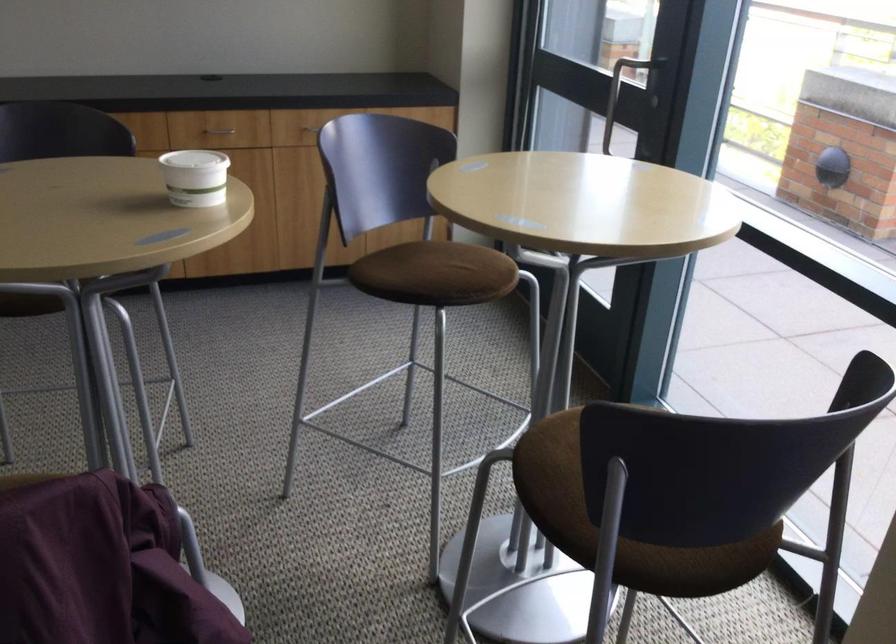
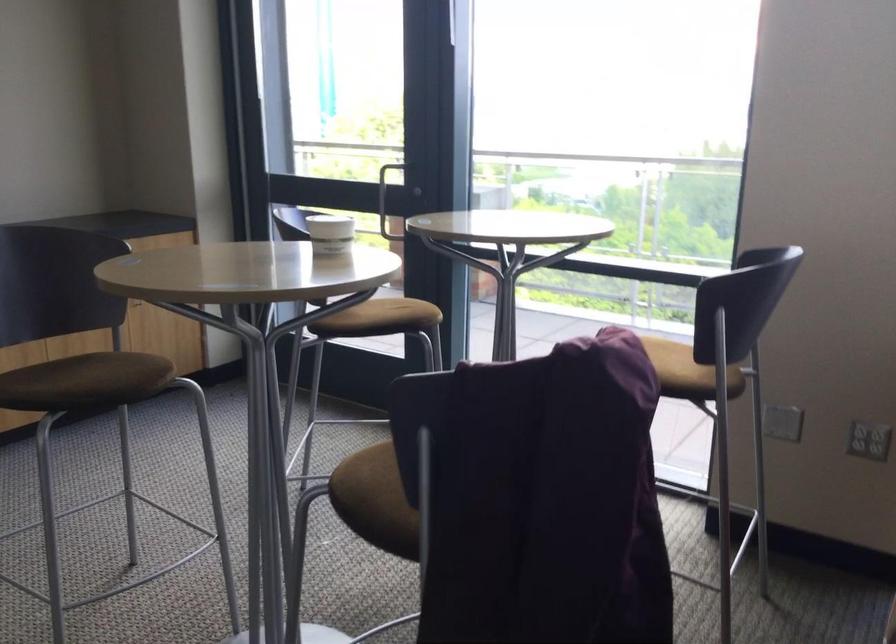
In the second image, find the point that corresponds to [435,274] in the first image.

(401, 314)